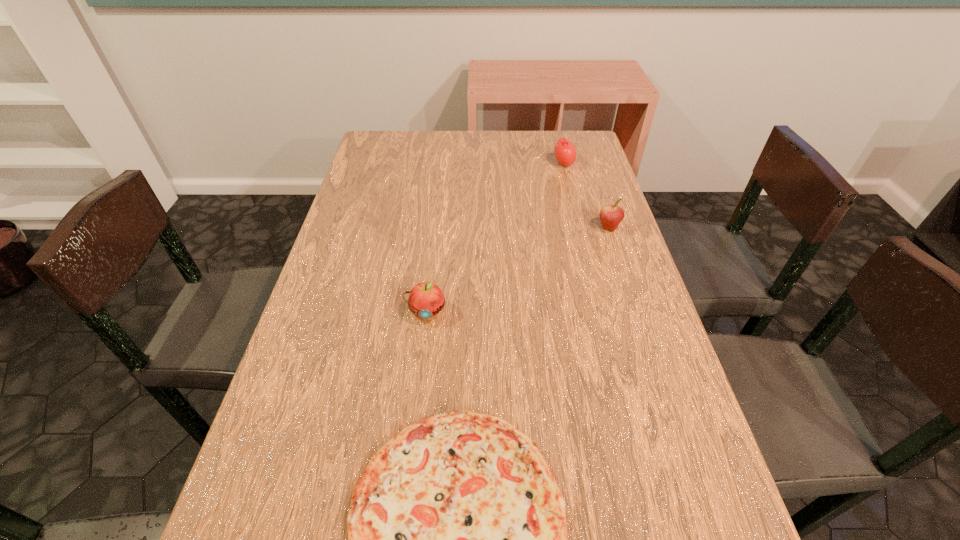
Find the location of a particular element. This screenshot has width=960, height=540. the rightmost object is located at coordinates (610, 215).

Find the location of `the third nearest object`. the third nearest object is located at coordinates (610, 215).

I want to click on the farthest object, so click(565, 152).

Find the location of a particular element. This screenshot has width=960, height=540. the second apple from left to right is located at coordinates (565, 152).

Where is `the nearest apple`? Image resolution: width=960 pixels, height=540 pixels. the nearest apple is located at coordinates (426, 299).

Where is `the leftmost apple`? the leftmost apple is located at coordinates (426, 299).

Locate an element on the screen. vacant space located on the front of the second farthest object is located at coordinates [617, 253].

This screenshot has width=960, height=540. What are the coordinates of `free spot located 0.110m on the front of the third object from left to right` in the screenshot? It's located at (570, 191).

I want to click on vacant region located on the back of the third farthest object, so click(x=435, y=235).

Where is `object present at the far edge`? The width and height of the screenshot is (960, 540). object present at the far edge is located at coordinates 565,152.